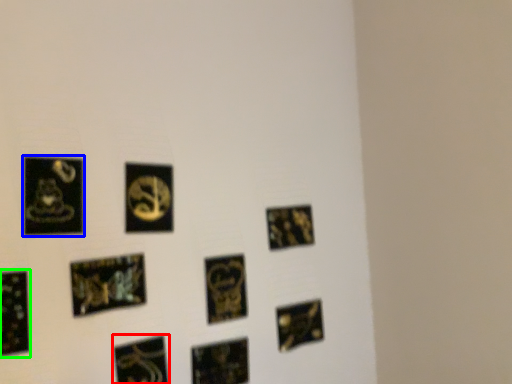
Question: Based on their relative distances, which object is nearer to picture frame (highlighted by a red box)? Choose from picture frame (highlighted by a blue box) and picture frame (highlighted by a green box).

Choices:
 (A) picture frame
 (B) picture frame

Answer: (B)